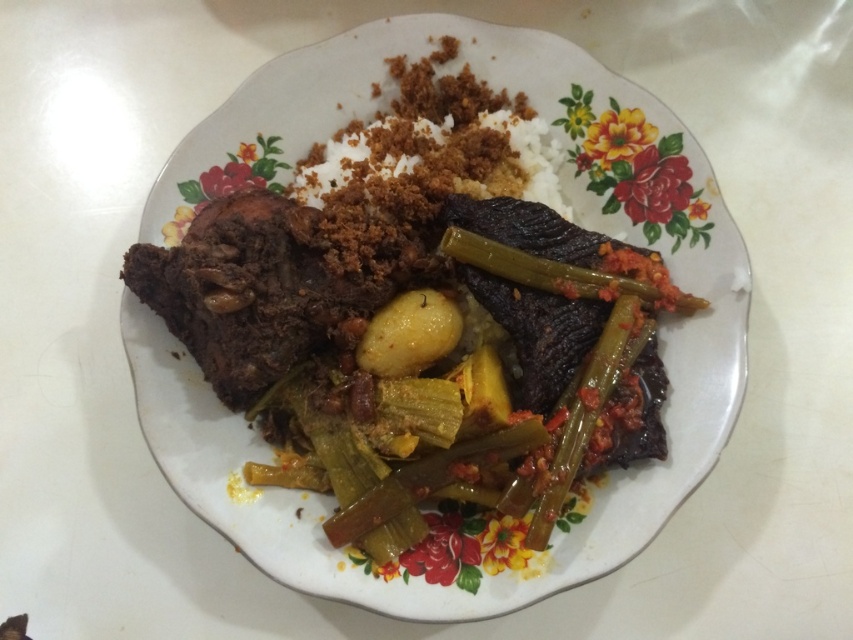
Based on the photo, you are a food critic evaluating this dish. Looking at the green glossy okra at center and the yellow matte potato at center, which one is positioned lower on the plate?

The green glossy okra at center is positioned below the yellow matte potato at center, so it is lower on the plate.